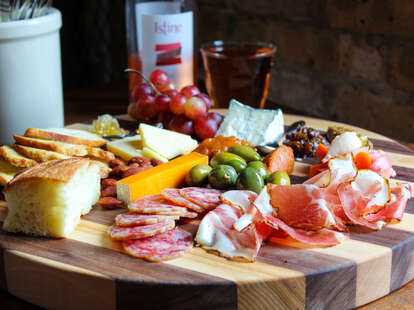
Where is `table`? The width and height of the screenshot is (414, 310). table is located at coordinates (403, 302).